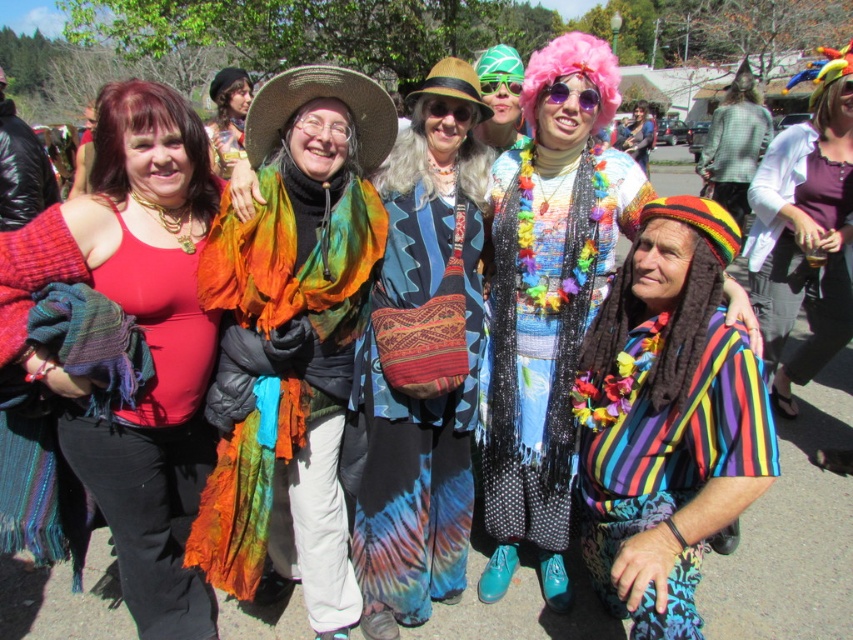
In the image, there are several people wearing different outfits. The pink synthetic wig at center is represented by point (x=407, y=160). What is the position of the pink synthetic wig at center relative to the group?

The pink synthetic wig at center is located at the center of the group, as indicated by its coordinates point (x=407, y=160).

You are a photographer taking a group photo. You want to ensure that the black beaded necklace at center is visible in the final image. Based on its position at point coordinates, where should you focus your camera lens?

The black beaded necklace at center is located at point coordinates (544, 330), so you should focus your camera lens at that position to ensure it is visible in the final image.

You are a photographer trying to capture a closeup of the pink synthetic wig at center and the multicolored fabric wig at center. Which wig is closer to the camera?

The pink synthetic wig at center is positioned under the multicolored fabric wig at center, so the multicolored fabric wig at center is closer to the camera.